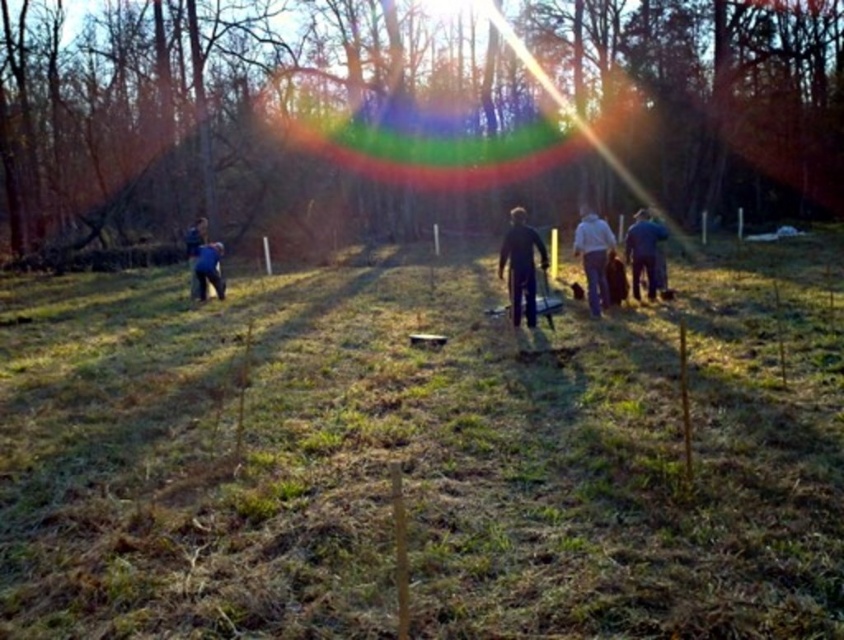
Question: Is black matte pants at center thinner than blue denim jeans at center?

Choices:
 (A) no
 (B) yes

Answer: (A)

Question: Which of the following is the closest to the observer?

Choices:
 (A) blue fabric at left
 (B) white cotton shirt at center
 (C) green matte tree at center

Answer: (B)

Question: Estimate the real-world distances between objects in this image. Which object is farther from the green grass at center?

Choices:
 (A) blue fabric person at left
 (B) black matte pants at center
 (C) green matte tree at center

Answer: (C)

Question: Does black matte pants at center appear on the right side of blue fabric at left?

Choices:
 (A) no
 (B) yes

Answer: (B)

Question: Is green grass at center bigger than white cotton shirt at center?

Choices:
 (A) no
 (B) yes

Answer: (B)

Question: Based on their relative distances, which object is farther from the blue denim jeans at center?

Choices:
 (A) green grass at center
 (B) green matte tree at center
 (C) black matte pants at center

Answer: (B)